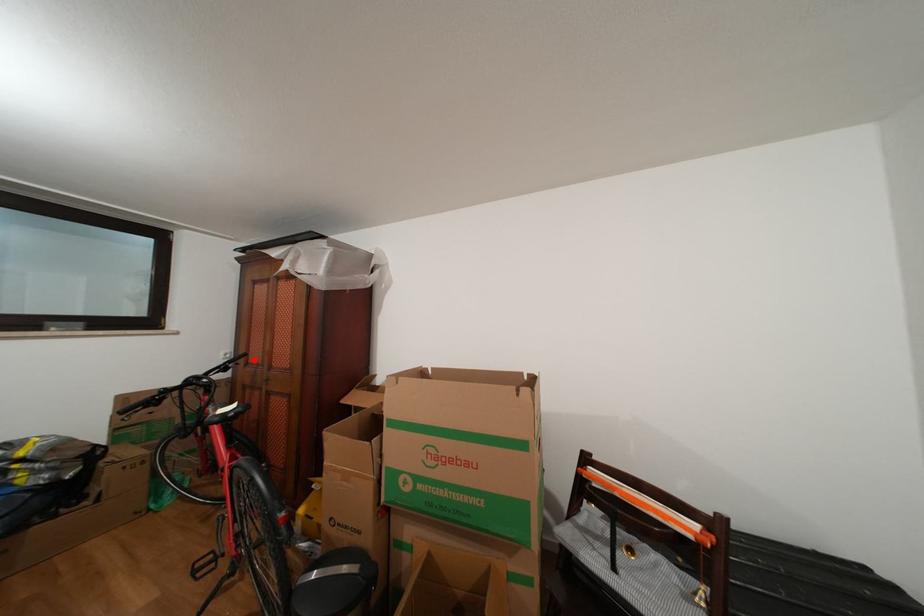
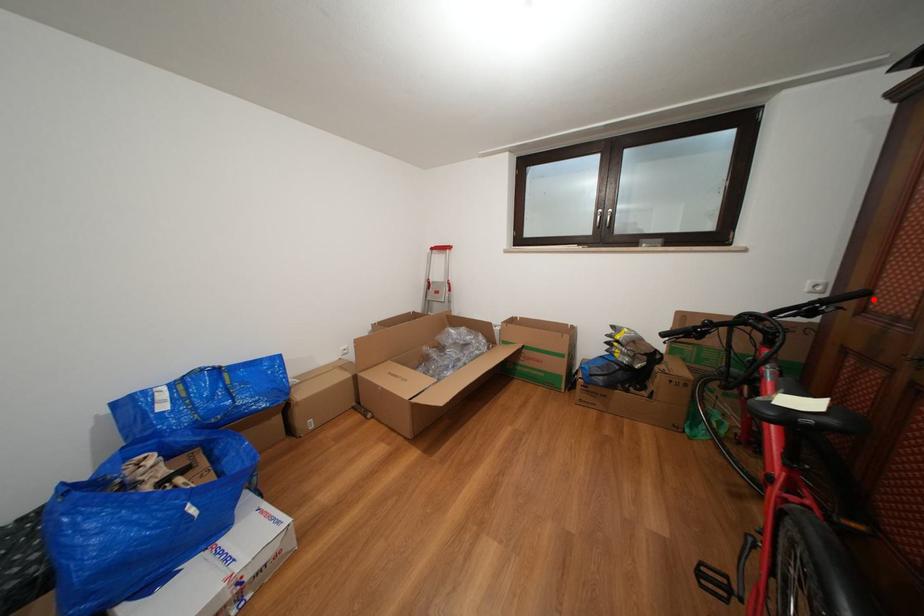
I am providing you with two images of the same scene from different viewpoints. A red point is marked on the first image and another point is marked on the second image. Does the point marked in image1 correspond to the same location as the one in image2?

Yes